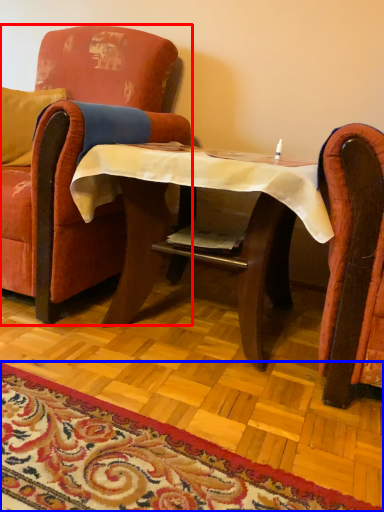
Question: Which object is closer to the camera taking this photo, chair (highlighted by a red box) or mat (highlighted by a blue box)?

Choices:
 (A) chair
 (B) mat

Answer: (B)